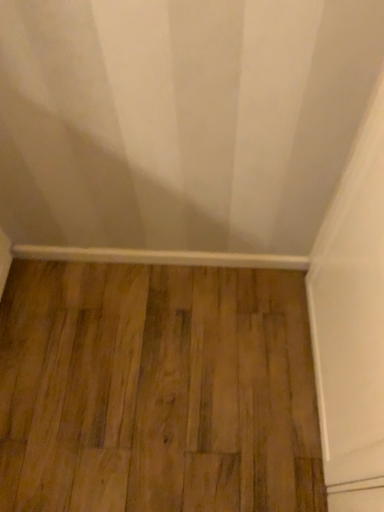
Locate an element on the screen. vacant region above white smooth baseboard at bottom (from a real-world perspective) is located at coordinates (186, 250).